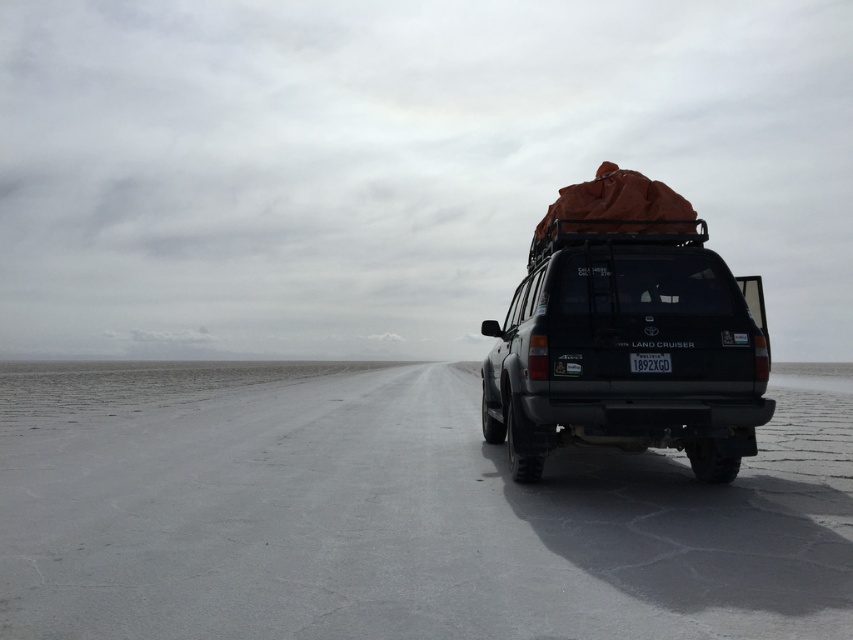
You are a driver who wants to know if your matte black suv at center can fit through a narrow passage that is only as wide as your black plastic license plate at center. Based on the scene, can it?

The matte black suv at center is wider than the black plastic license plate at center, so it cannot fit through a passage as narrow as the license plate.

You are a photographer planning to take a wide shot of the matte black suv at center and the black plastic license plate at center in the scene described. Which object will appear taller in your photo?

The matte black suv at center will appear taller in the photo because it has a greater height compared to the black plastic license plate at center.